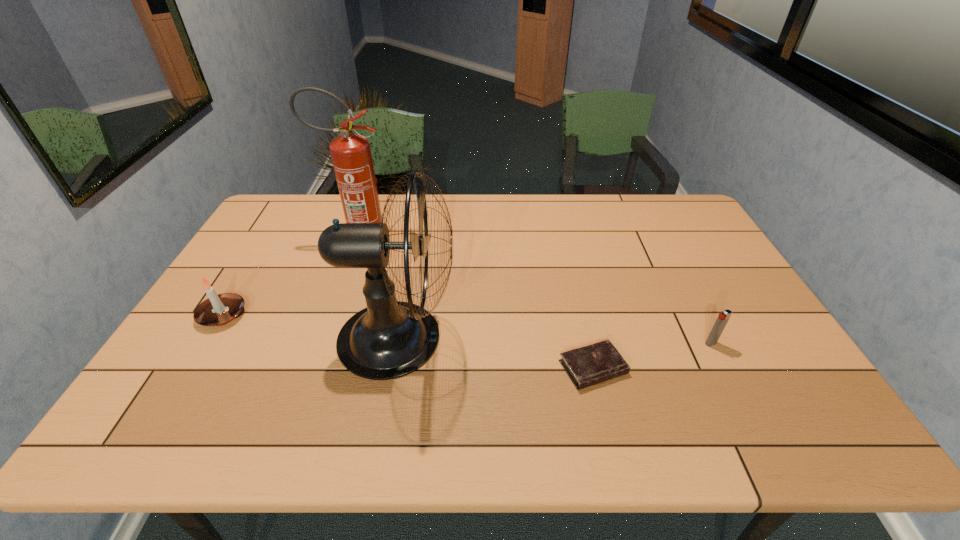
The image size is (960, 540). Identify the location of free location that satisfies the following two spatial constraints: 1. on the back side of the rightmost object; 2. from the nozzle of the farthest object. (658, 239).

Where is `free space that satisfies the following two spatial constraints: 1. on the front-facing side of the fan; 2. on the back side of the rightmost object`? The image size is (960, 540). free space that satisfies the following two spatial constraints: 1. on the front-facing side of the fan; 2. on the back side of the rightmost object is located at coordinates (396, 343).